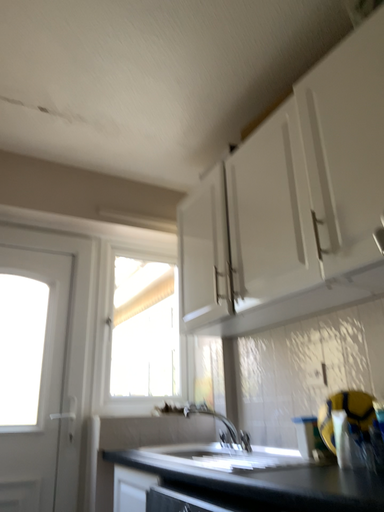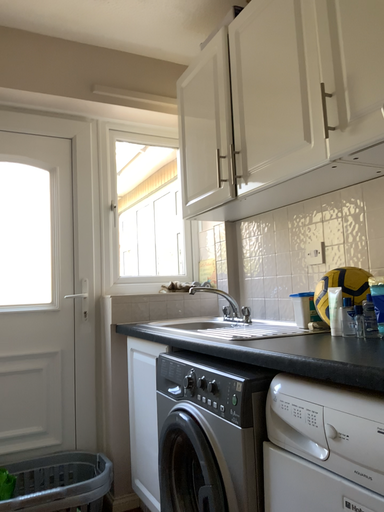
Question: Which way did the camera rotate in the video?

Choices:
 (A) rotated downward
 (B) rotated upward

Answer: (A)